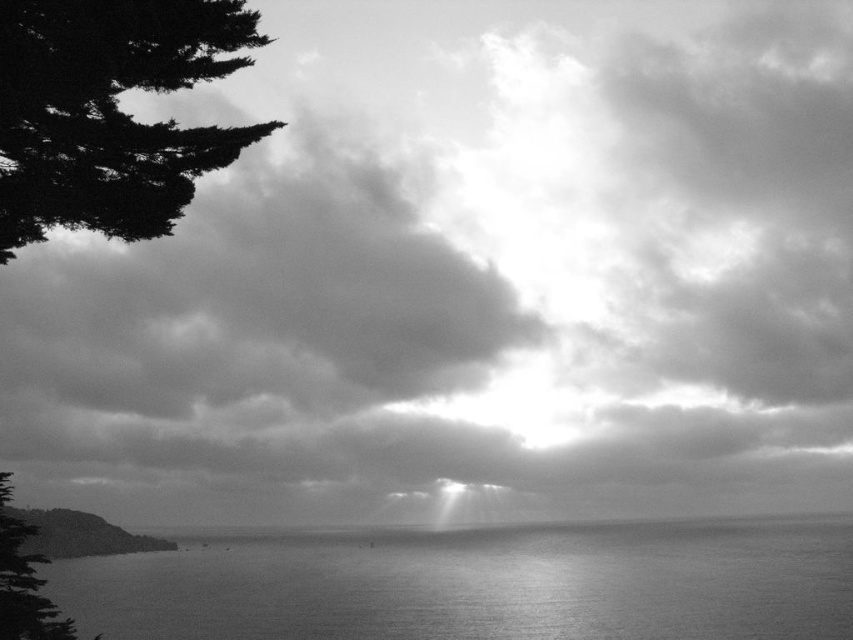
The width and height of the screenshot is (853, 640). What do you see at coordinates (477, 582) in the screenshot? I see `smooth water at center` at bounding box center [477, 582].

Who is higher up, smooth water at center or dark green textured tree at upper left?

dark green textured tree at upper left is higher up.

You are a GUI agent. You are given a task and a screenshot of the screen. Output one action in this format:
    pyautogui.click(x=<x>, y=<y>)
    Task: Click on the smooth water at center
    The width and height of the screenshot is (853, 640).
    Given the screenshot: What is the action you would take?
    pyautogui.click(x=477, y=582)

Which is below, dark green textured tree at upper left or silvery textured tree at left?

silvery textured tree at left is lower down.

Is dark green textured tree at upper left shorter than silvery textured tree at left?

Yes, dark green textured tree at upper left is shorter than silvery textured tree at left.

Is point (10, 104) farther from camera compared to point (35, 618)?

That is False.

You are a GUI agent. You are given a task and a screenshot of the screen. Output one action in this format:
    pyautogui.click(x=<x>, y=<y>)
    Task: Click on the dark green textured tree at upper left
    
    Given the screenshot: What is the action you would take?
    pyautogui.click(x=109, y=113)

Which is more to the right, smooth water at center or silvery textured tree at left?

Positioned to the right is smooth water at center.

The width and height of the screenshot is (853, 640). What do you see at coordinates (477, 582) in the screenshot? I see `smooth water at center` at bounding box center [477, 582].

At what (x,y) coordinates should I click in order to perform the action: click on smooth water at center. Please return your answer as a coordinate pair (x, y). The width and height of the screenshot is (853, 640). Looking at the image, I should click on (477, 582).